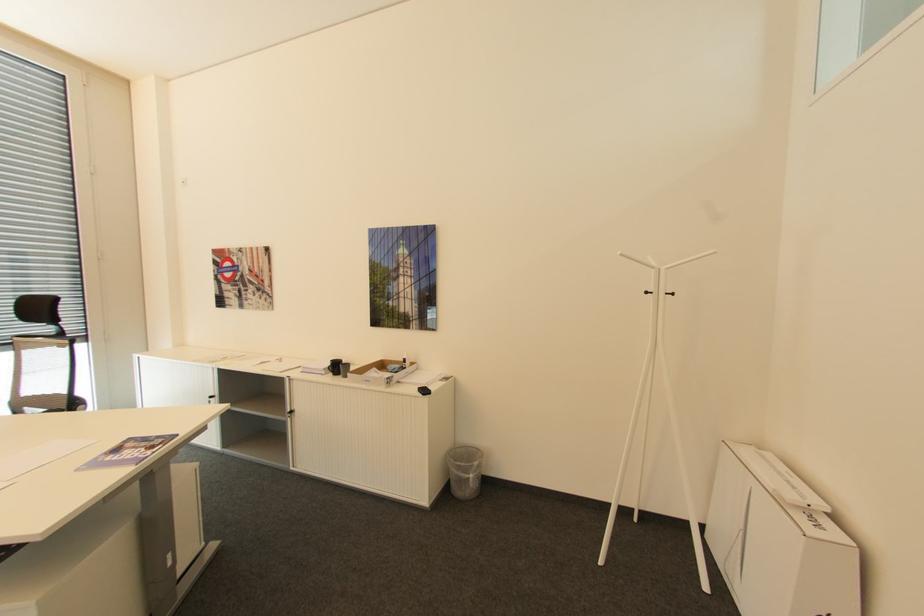
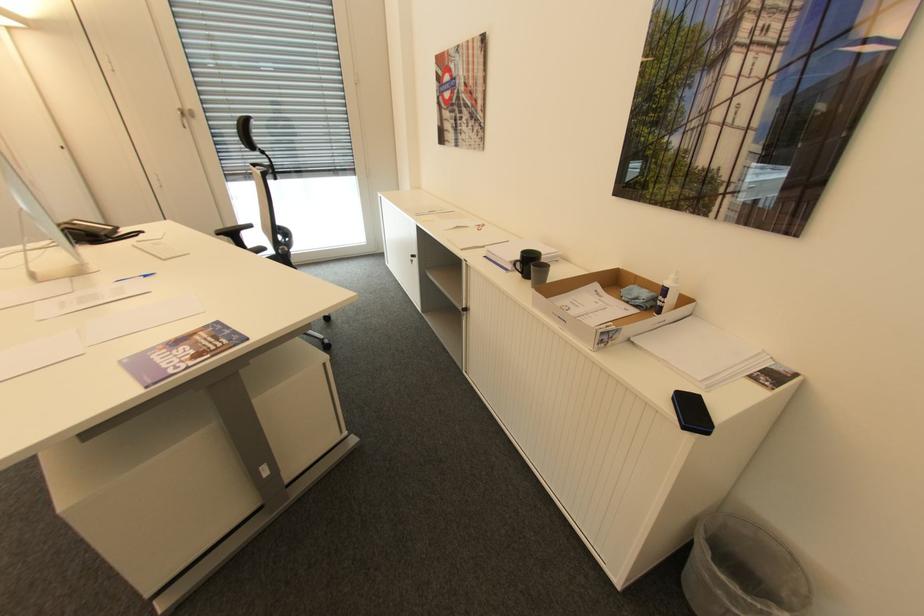
In the second image, find the point that corresponds to [351,365] in the first image.

(550, 268)